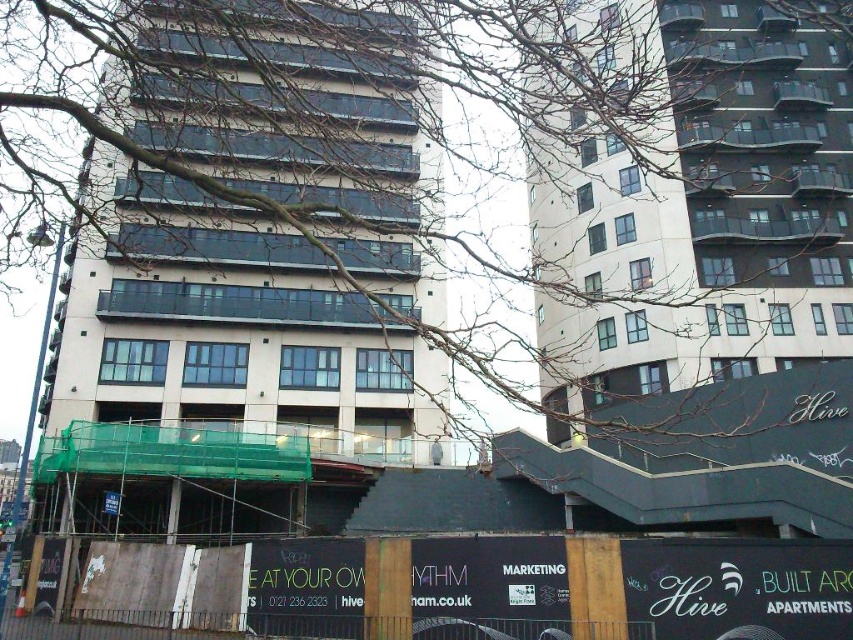
Image resolution: width=853 pixels, height=640 pixels. What do you see at coordinates (260, 237) in the screenshot? I see `beige concrete building at left` at bounding box center [260, 237].

Between beige concrete building at left and smooth concrete building at upper center, which one appears on the right side from the viewer's perspective?

smooth concrete building at upper center is more to the right.

What do you see at coordinates (260, 237) in the screenshot?
I see `beige concrete building at left` at bounding box center [260, 237].

Find the location of a particular element. The height and width of the screenshot is (640, 853). beige concrete building at left is located at coordinates (260, 237).